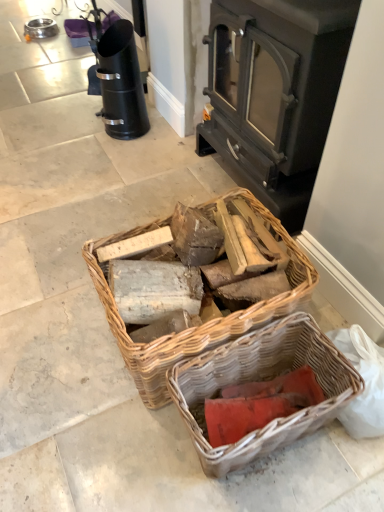
Question: Is red cardboard at lower center bigger or smaller than woven wood basket at center, which ranks as the 2th picnic basket in bottom-to-top order?

Choices:
 (A) big
 (B) small

Answer: (B)

Question: Considering the positions of point (253, 382) and point (228, 330), is point (253, 382) closer or farther from the camera than point (228, 330)?

Choices:
 (A) farther
 (B) closer

Answer: (A)

Question: Based on their relative distances, which object is nearer to the dark gray metal wood burning stove at center?

Choices:
 (A) woven wood basket at center, the first picnic basket viewed from the top
 (B) rustic wicker basket at lower center, which appears as the second picnic basket when viewed from the top
 (C) red cardboard at lower center

Answer: (A)

Question: Estimate the real-world distances between objects in this image. Which object is closer to the woven wood basket at center, which ranks as the 2th picnic basket in bottom-to-top order?

Choices:
 (A) dark gray metal wood burning stove at center
 (B) red cardboard at lower center
 (C) rustic wicker basket at lower center, which is the 1th picnic basket in bottom-to-top order

Answer: (C)